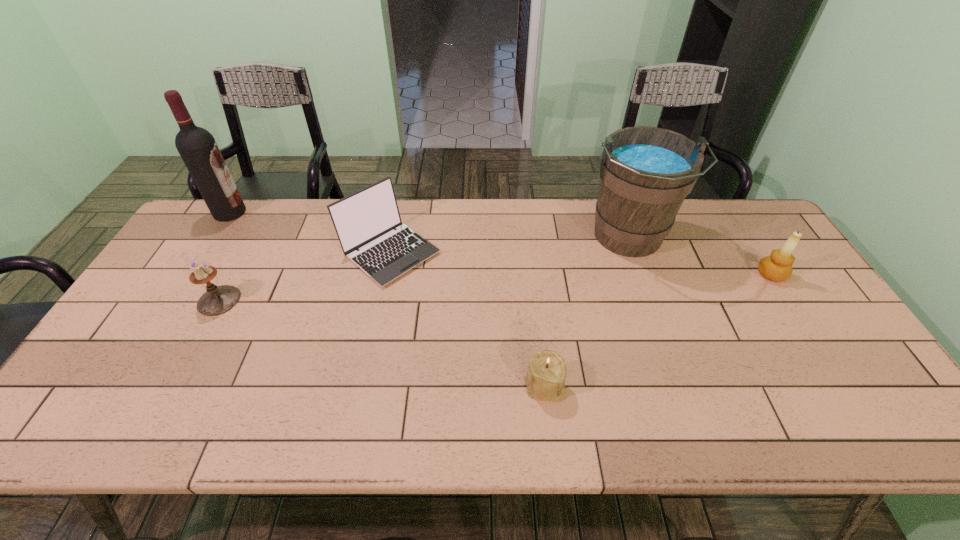
Where is `free spot between the wine bucket and the rightmost candle_holder`? free spot between the wine bucket and the rightmost candle_holder is located at coordinates (700, 256).

At what (x,y) coordinates should I click in order to perform the action: click on unoccupied area between the rightmost candle_holder and the second object from right to left. Please return your answer as a coordinate pair (x, y). The image size is (960, 540). Looking at the image, I should click on [700, 256].

You are a GUI agent. You are given a task and a screenshot of the screen. Output one action in this format:
    pyautogui.click(x=<x>, y=<y>)
    Task: Click on the unoccupied position between the wine bottle and the laptop_computer
    
    Given the screenshot: What is the action you would take?
    pyautogui.click(x=310, y=232)

Locate an element on the screen. The image size is (960, 540). free space between the rightmost object and the leftmost candle_holder is located at coordinates (495, 287).

Image resolution: width=960 pixels, height=540 pixels. I want to click on empty space that is in between the wine bucket and the leftmost candle_holder, so click(423, 269).

Locate an element on the screen. The image size is (960, 540). empty space between the laptop_computer and the rightmost object is located at coordinates [581, 264].

Identify the location of vacant point located between the second object from right to left and the rightmost candle_holder. (700, 256).

This screenshot has height=540, width=960. I want to click on free space between the leftmost object and the fifth object from left to right, so click(429, 226).

Identify the location of the second closest object relative to the second tallest object. This screenshot has width=960, height=540. (545, 379).

At what (x,y) coordinates should I click in order to perform the action: click on the third closest object to the laptop_computer. Please return your answer as a coordinate pair (x, y). Image resolution: width=960 pixels, height=540 pixels. Looking at the image, I should click on (198, 149).